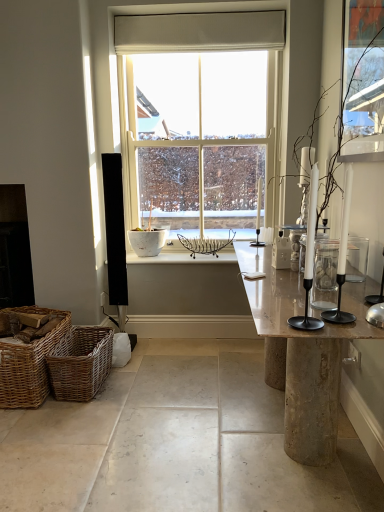
Question: Relative to marble table at center, is woven brown picnic basket at lower left, arranged as the 1th picnic basket when viewed from the right, in front or behind?

Choices:
 (A) front
 (B) behind

Answer: (B)

Question: Based on their sizes in the image, would you say woven brown picnic basket at lower left, arranged as the 1th picnic basket when viewed from the right, is bigger or smaller than marble table at center?

Choices:
 (A) big
 (B) small

Answer: (B)

Question: Estimate the real-world distances between objects in this image. Which object is closer to the white marble tray at center?

Choices:
 (A) white glass window at center
 (B) clear glass jar at right
 (C) transparent glass window screen at upper right
 (D) woven brown picnic basket at lower left, the second picnic basket when ordered from right to left
 (E) woven brown picnic basket at lower left, which is counted as the second picnic basket, starting from the left

Answer: (E)

Question: Based on their relative distances, which object is farther from the white fabric curtain at upper center?

Choices:
 (A) white marble tray at center
 (B) white glass window at center
 (C) smooth concrete table at lower center
 (D) white glossy candle holder at center
 (E) marble table at center

Answer: (C)